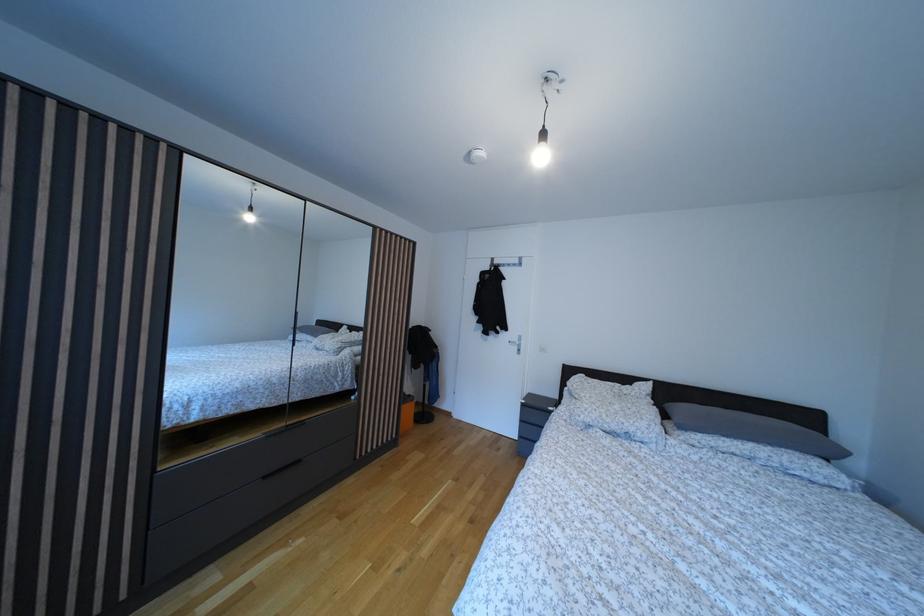
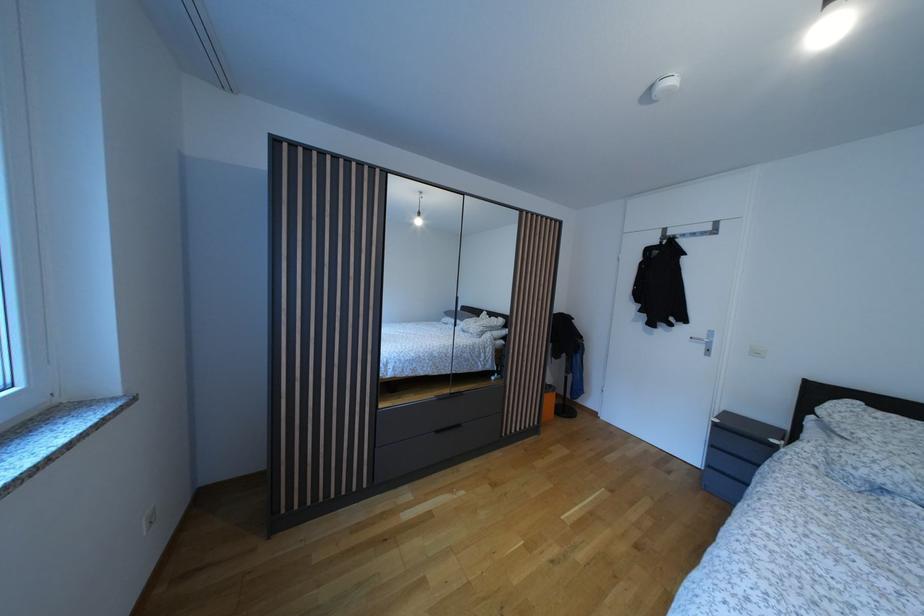
The point at (523,346) is marked in the first image. Where is the corresponding point in the second image?

(709, 342)